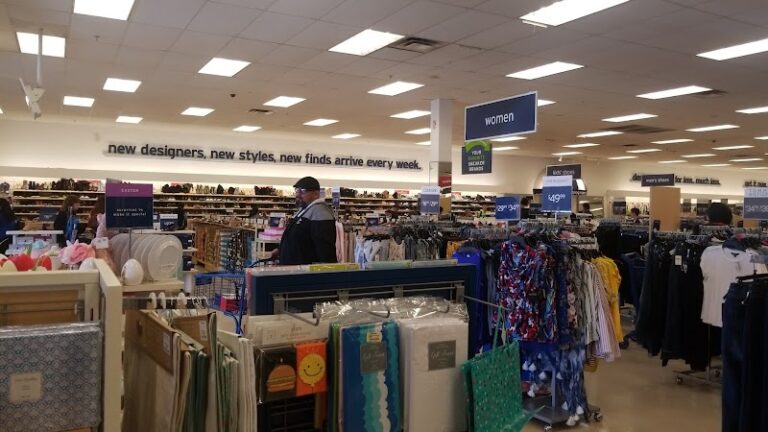
You are a GUI agent. You are given a task and a screenshot of the screen. Output one action in this format:
    pyautogui.click(x=<x>, y=<y>)
    Task: Click on the racks
    The height and width of the screenshot is (432, 768).
    Given the screenshot: What is the action you would take?
    pyautogui.click(x=583, y=314)